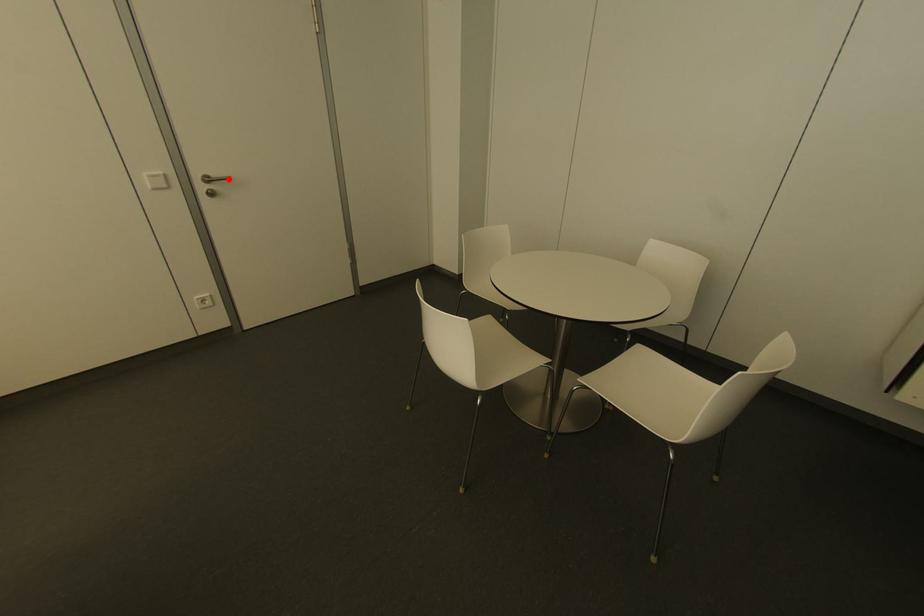
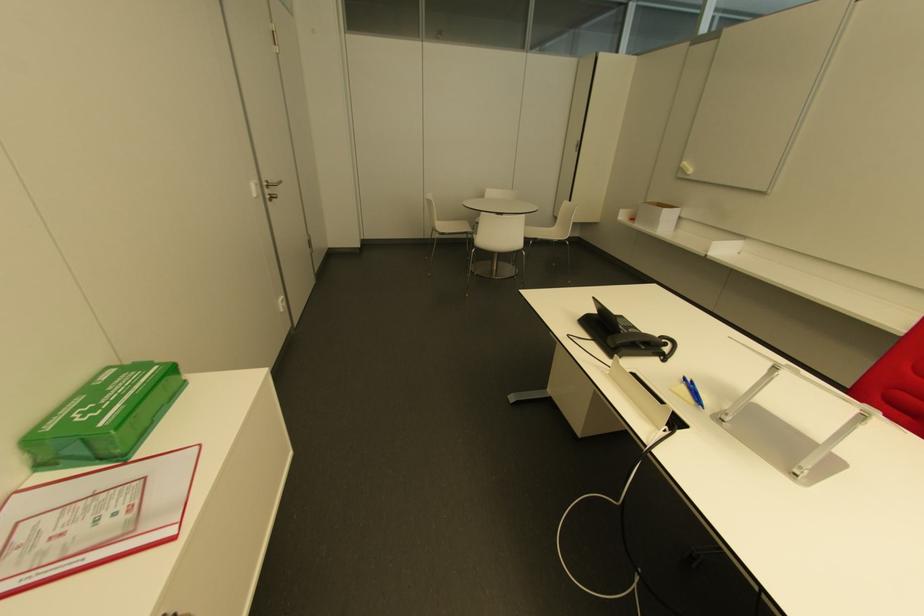
Find the pixel in the second image that matches the highlighted location in the first image.

(278, 182)